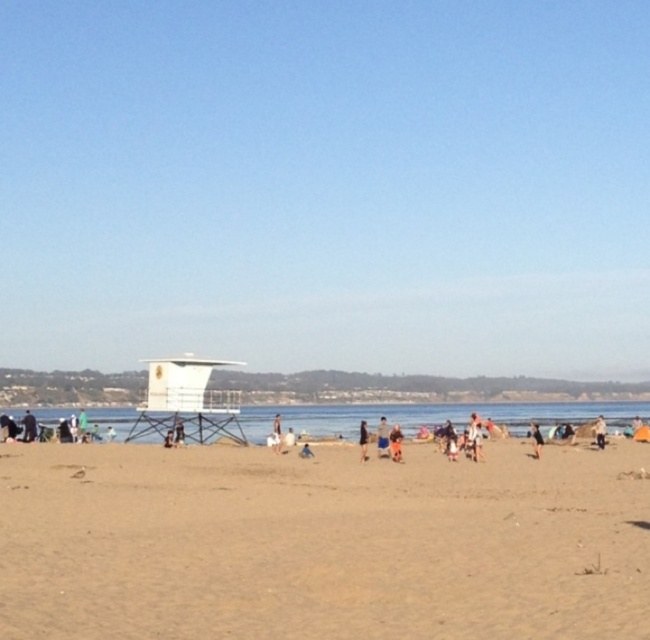
Question: Is white plastic lifeguard tower at center closer to camera compared to dark blue jeans at center?

Choices:
 (A) yes
 (B) no

Answer: (B)

Question: Which object appears closest to the camera in this image?

Choices:
 (A) brown textured shorts at center
 (B) tan fabric towel at lower right

Answer: (A)

Question: Which point is closer to the camera taking this photo?

Choices:
 (A) (361, 440)
 (B) (540, 220)

Answer: (A)

Question: Which point is closer to the camera taking this photo?

Choices:
 (A) (536, 432)
 (B) (543, 518)
 (C) (400, 433)

Answer: (B)

Question: Can you confirm if white plastic lifeguard tower at center is thinner than light brown sand at lower right?

Choices:
 (A) yes
 (B) no

Answer: (B)

Question: Can you confirm if tan fabric shorts at center is positioned to the left of brown textured shorts at center?

Choices:
 (A) yes
 (B) no

Answer: (A)